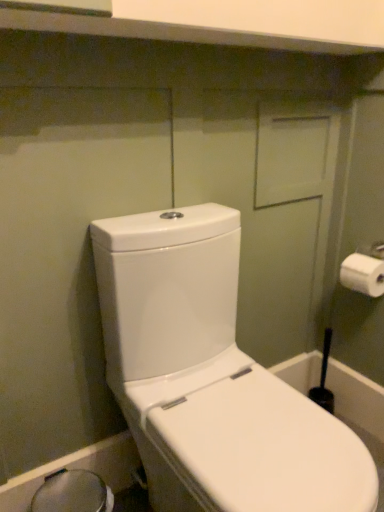
Locate an element on the screen. The height and width of the screenshot is (512, 384). transparent plastic bidet at lower left is located at coordinates (73, 493).

Is white matte toilet paper at right turned away from transparent plastic bidet at lower left?

That's not correct — white matte toilet paper at right is not looking away from transparent plastic bidet at lower left.

From a real-world perspective, who is located higher, white matte toilet paper at right or transparent plastic bidet at lower left?

white matte toilet paper at right.

Between point (350, 283) and point (49, 490), which one is positioned in front?

Positioned in front is point (49, 490).

Is transparent plastic bidet at lower left not within white matte toilet paper at right?

Indeed, transparent plastic bidet at lower left is completely outside white matte toilet paper at right.

Looking at their sizes, would you say transparent plastic bidet at lower left is wider or thinner than white matte toilet paper at right?

transparent plastic bidet at lower left is wider than white matte toilet paper at right.

Considering the sizes of objects transparent plastic bidet at lower left and white matte toilet paper at right in the image provided, who is bigger, transparent plastic bidet at lower left or white matte toilet paper at right?

transparent plastic bidet at lower left.

Is transparent plastic bidet at lower left not near white matte toilet paper at right?

Yes, transparent plastic bidet at lower left and white matte toilet paper at right are located far from each other.

In the scene shown: From the image's perspective, which one is positioned lower, transparent plastic bidet at lower left or white glossy toilet at left?

From the image's view, transparent plastic bidet at lower left is below.

In terms of width, does transparent plastic bidet at lower left look wider or thinner when compared to white glossy toilet at left?

Clearly, transparent plastic bidet at lower left has less width compared to white glossy toilet at left.

Considering the relative sizes of transparent plastic bidet at lower left and white glossy toilet at left in the image provided, is transparent plastic bidet at lower left smaller than white glossy toilet at left?

Indeed, transparent plastic bidet at lower left has a smaller size compared to white glossy toilet at left.

Is transparent plastic bidet at lower left not inside white glossy toilet at left?

Yes, transparent plastic bidet at lower left is located beyond the bounds of white glossy toilet at left.

Is the surface of white glossy toilet at left in direct contact with white matte toilet paper at right?

No, white glossy toilet at left is not in contact with white matte toilet paper at right.

Is white matte toilet paper at right completely or partially inside white glossy toilet at left?

No, white matte toilet paper at right is not inside white glossy toilet at left.

Is white glossy toilet at left wider than white matte toilet paper at right?

Yes, white glossy toilet at left is wider than white matte toilet paper at right.

There is a white glossy toilet at left. Where is `toilet paper above it (from a real-world perspective)`? This screenshot has width=384, height=512. toilet paper above it (from a real-world perspective) is located at coordinates (363, 274).

Are white matte toilet paper at right and white glossy toilet at left making contact?

No, white matte toilet paper at right is not making contact with white glossy toilet at left.

Is white matte toilet paper at right thinner than white glossy toilet at left?

Indeed, white matte toilet paper at right has a lesser width compared to white glossy toilet at left.

Is white matte toilet paper at right behind white glossy toilet at left?

Yes, white matte toilet paper at right is further from the viewer.

Is white glossy toilet at left at the back of white matte toilet paper at right?

No, white glossy toilet at left is not at the back of white matte toilet paper at right.

From a real-world perspective, is white glossy toilet at left located beneath transparent plastic bidet at lower left?

No, from a real-world perspective, white glossy toilet at left is not under transparent plastic bidet at lower left.

Which point is more distant from viewer, (x=167, y=285) or (x=82, y=474)?

Point (x=82, y=474)

Between white glossy toilet at left and transparent plastic bidet at lower left, which one appears on the right side from the viewer's perspective?

white glossy toilet at left is more to the right.

From the image's perspective, which is below, white glossy toilet at left or transparent plastic bidet at lower left?

transparent plastic bidet at lower left appears lower in the image.

Locate an element on the screen. The height and width of the screenshot is (512, 384). bidet in front of the white matte toilet paper at right is located at coordinates (73, 493).

The image size is (384, 512). What are the coordinates of `toilet paper above the transparent plastic bidet at lower left (from the image's perspective)` in the screenshot? It's located at (363, 274).

Looking at the image, which one is located closer to transparent plastic bidet at lower left, white glossy toilet at left or white matte toilet paper at right?

white glossy toilet at left lies closer to transparent plastic bidet at lower left than the other object.

Which object lies further to the anchor point transparent plastic bidet at lower left, white matte toilet paper at right or white glossy toilet at left?

Based on the image, white matte toilet paper at right appears to be further to transparent plastic bidet at lower left.

Based on their spatial positions, is transparent plastic bidet at lower left or white glossy toilet at left closer to white matte toilet paper at right?

Based on the image, white glossy toilet at left appears to be nearer to white matte toilet paper at right.

Which object lies nearer to the anchor point white matte toilet paper at right, white glossy toilet at left or transparent plastic bidet at lower left?

white glossy toilet at left lies closer to white matte toilet paper at right than the other object.

When comparing their distances from white glossy toilet at left, does white matte toilet paper at right or transparent plastic bidet at lower left seem further?

white matte toilet paper at right lies further to white glossy toilet at left than the other object.

Estimate the real-world distances between objects in this image. Which object is closer to white glossy toilet at left, transparent plastic bidet at lower left or white matte toilet paper at right?

The object closer to white glossy toilet at left is transparent plastic bidet at lower left.

This screenshot has width=384, height=512. What are the coordinates of `toilet between transparent plastic bidet at lower left and white matte toilet paper at right` in the screenshot? It's located at (210, 378).